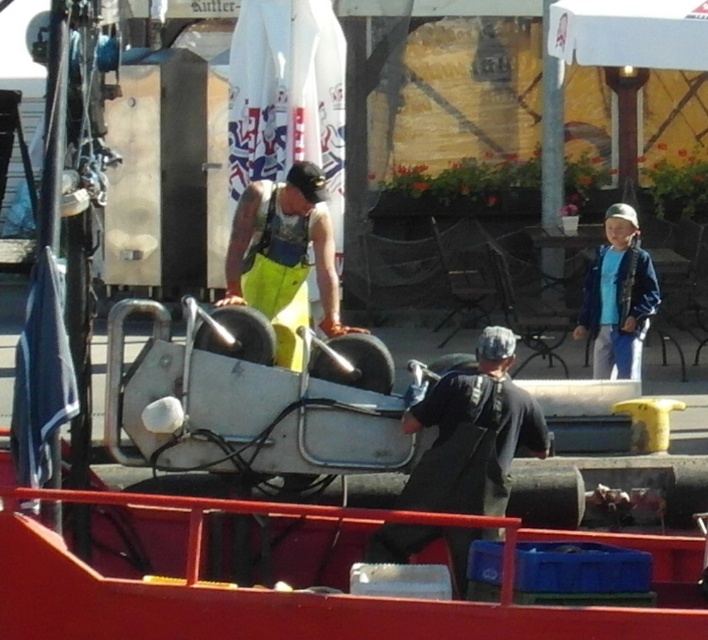
Can you confirm if dark gray fabric jacket at center is bigger than yellow fabric worker at center?

Incorrect, dark gray fabric jacket at center is not larger than yellow fabric worker at center.

How distant is dark gray fabric jacket at center from yellow fabric worker at center?

dark gray fabric jacket at center and yellow fabric worker at center are 6.78 feet apart from each other.

Describe the element at coordinates (472, 433) in the screenshot. I see `dark gray fabric jacket at center` at that location.

Where is `dark gray fabric jacket at center`? dark gray fabric jacket at center is located at coordinates (472, 433).

Can you confirm if dark gray fabric jacket at center is shorter than blue denim jacket at right?

Yes.

Image resolution: width=708 pixels, height=640 pixels. What do you see at coordinates (472, 433) in the screenshot? I see `dark gray fabric jacket at center` at bounding box center [472, 433].

Is point (462, 452) more distant than point (627, 360)?

No, (462, 452) is in front of (627, 360).

What are the coordinates of `dark gray fabric jacket at center` in the screenshot? It's located at (472, 433).

Looking at this image, is yellow fabric worker at center wider than blue denim jacket at right?

Yes, yellow fabric worker at center is wider than blue denim jacket at right.

Looking at this image, does yellow fabric worker at center lie behind blue denim jacket at right?

That is False.

Is point (302, 269) behind point (653, 284)?

That is False.

Where is `yellow fabric worker at center`? The height and width of the screenshot is (640, 708). yellow fabric worker at center is located at coordinates (285, 257).